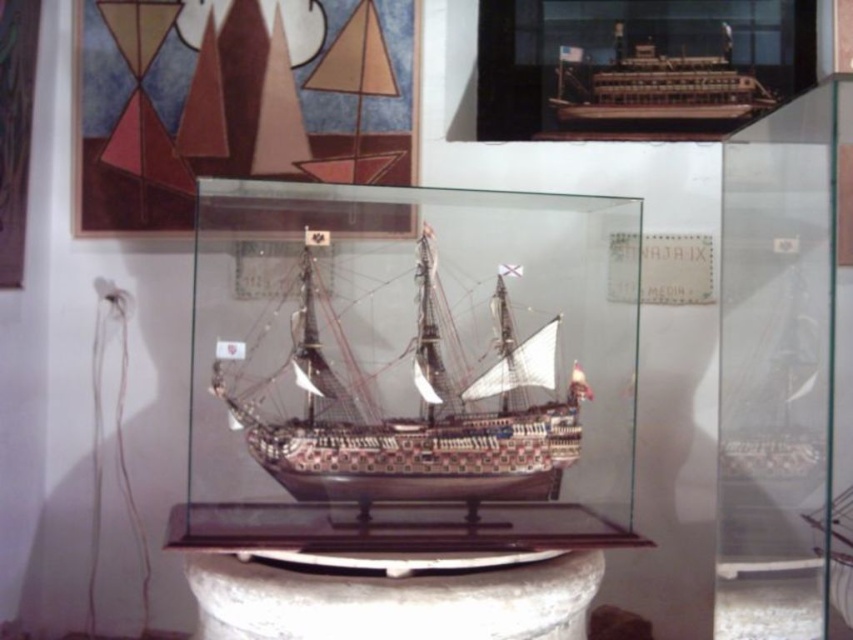
Question: Among these points, which one is nearest to the camera?

Choices:
 (A) (634, 131)
 (B) (350, 497)

Answer: (B)

Question: Which point appears closest to the camera in this image?

Choices:
 (A) (724, 124)
 (B) (338, 492)

Answer: (B)

Question: Is wooden ship at center wider than wooden ship at upper center?

Choices:
 (A) no
 (B) yes

Answer: (B)

Question: Does wooden ship at center have a larger size compared to wooden ship at upper center?

Choices:
 (A) yes
 (B) no

Answer: (A)

Question: Does wooden ship at center appear on the right side of wooden ship at upper center?

Choices:
 (A) no
 (B) yes

Answer: (A)